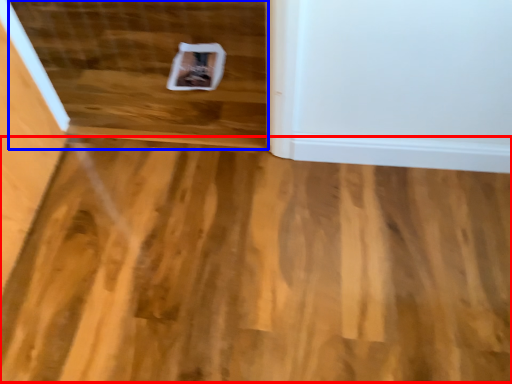
Question: Which object is further to the camera taking this photo, plywood (highlighted by a red box) or stairwell (highlighted by a blue box)?

Choices:
 (A) plywood
 (B) stairwell

Answer: (B)